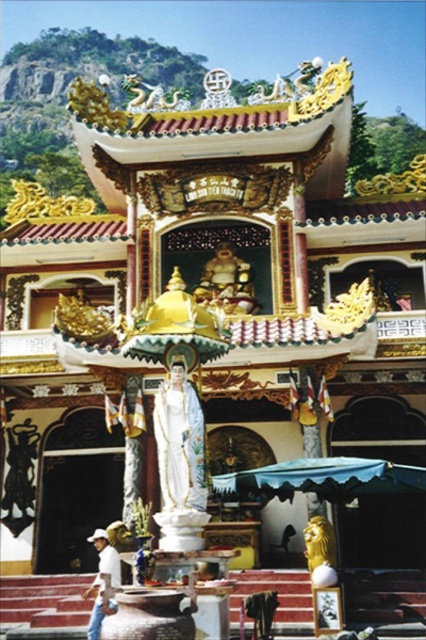
Question: Does gold polished statue at center have a larger size compared to white cotton shirt at lower left?

Choices:
 (A) yes
 (B) no

Answer: (B)

Question: Which point appears closest to the camera in this image?

Choices:
 (A) (109, 608)
 (B) (192, 433)

Answer: (B)

Question: Is the position of gold polished statue at center less distant than that of white cotton shirt at lower left?

Choices:
 (A) no
 (B) yes

Answer: (A)

Question: Does white glossy statue at center have a greater width compared to white cotton shirt at lower left?

Choices:
 (A) no
 (B) yes

Answer: (A)

Question: Estimate the real-world distances between objects in this image. Which object is farther from the gold polished statue at center?

Choices:
 (A) white cotton shirt at lower left
 (B) white glossy statue at center

Answer: (A)

Question: Which object appears closest to the camera in this image?

Choices:
 (A) white cotton shirt at lower left
 (B) gold polished statue at center

Answer: (A)